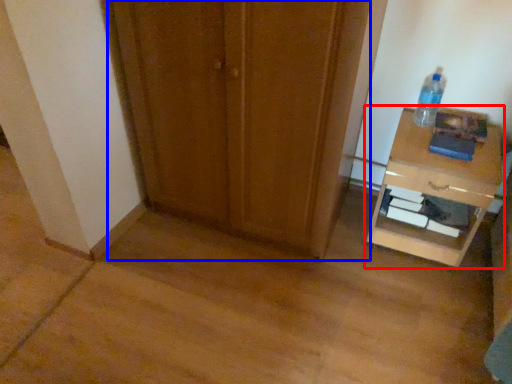
Question: Which object is further to the camera taking this photo, nightstand (highlighted by a red box) or door (highlighted by a blue box)?

Choices:
 (A) nightstand
 (B) door

Answer: (A)